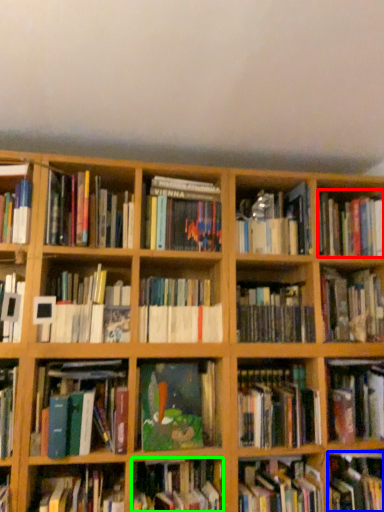
Question: Estimate the real-world distances between objects in this image. Which object is closer to book (highlighted by a red box), book (highlighted by a blue box) or book (highlighted by a green box)?

Choices:
 (A) book
 (B) book

Answer: (A)